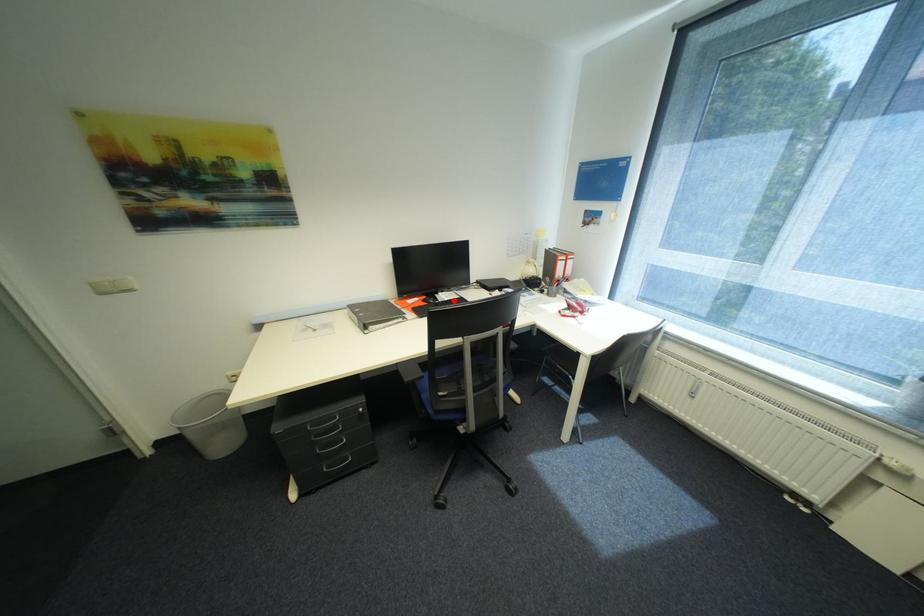
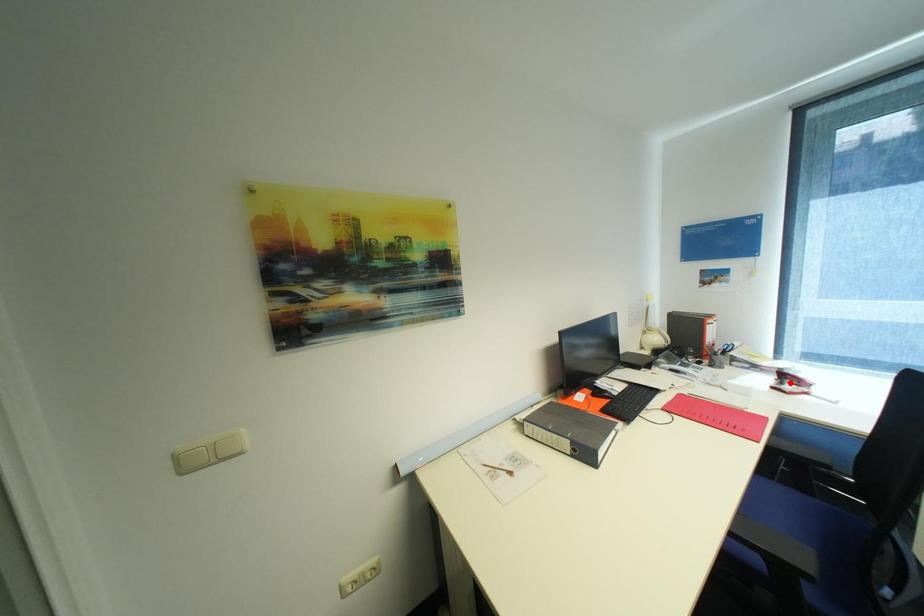
I am providing you with two images of the same scene from different viewpoints. A red point is marked on the first image and another point is marked on the second image. Is the red point in image1 aligned with the point shown in image2?

No